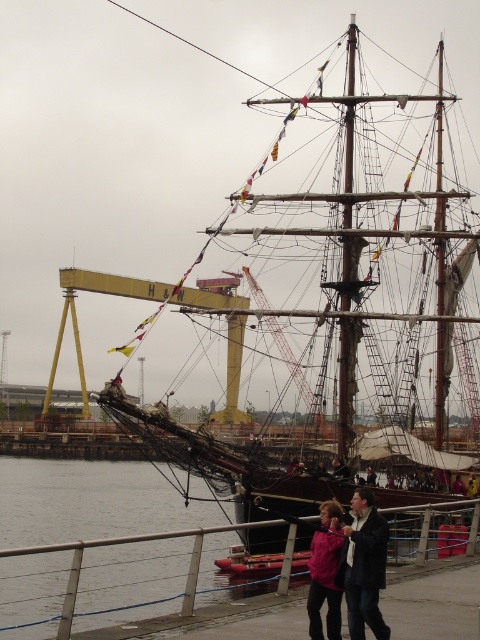
Question: Which object is the closest to the matte pink jacket at lower center?

Choices:
 (A) dark pink fabric jacket at lower center
 (B) clear water at lower left

Answer: (A)

Question: Is the position of clear water at lower left less distant than that of matte pink jacket at lower center?

Choices:
 (A) no
 (B) yes

Answer: (A)

Question: Considering the relative positions of dark pink fabric jacket at lower center and matte pink jacket at lower center in the image provided, where is dark pink fabric jacket at lower center located with respect to matte pink jacket at lower center?

Choices:
 (A) right
 (B) left

Answer: (A)

Question: Considering the relative positions of clear water at lower left and dark pink fabric jacket at lower center in the image provided, where is clear water at lower left located with respect to dark pink fabric jacket at lower center?

Choices:
 (A) right
 (B) left

Answer: (B)

Question: Which of the following is the farthest from the observer?

Choices:
 (A) matte pink jacket at lower center
 (B) dark pink fabric jacket at lower center

Answer: (A)

Question: Which is nearer to the clear water at lower left?

Choices:
 (A) matte pink jacket at lower center
 (B) wooden ship at center
 (C) dark pink fabric jacket at lower center

Answer: (B)